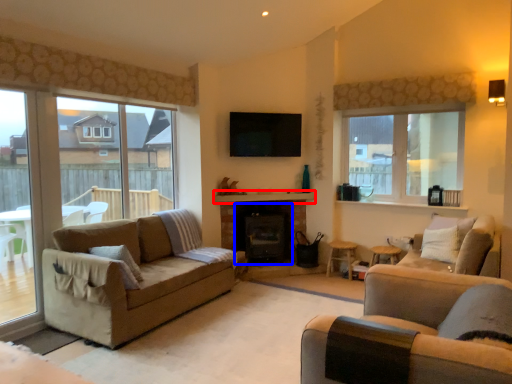
Question: Which point is closer to the camera, mantle (highlighted by a red box) or fireplace (highlighted by a blue box)?

Choices:
 (A) mantle
 (B) fireplace

Answer: (A)